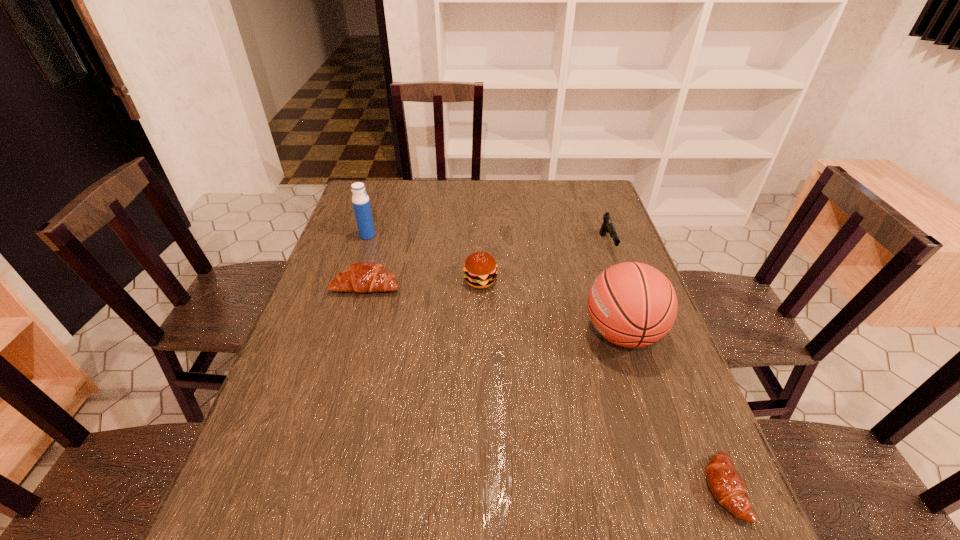
Where is `gun positioned at the right edge`? gun positioned at the right edge is located at coordinates (607, 227).

Image resolution: width=960 pixels, height=540 pixels. What are the coordinates of `basketball that is at the right edge` in the screenshot? It's located at (631, 304).

What are the coordinates of `object present at the near right corner` in the screenshot? It's located at (727, 486).

The height and width of the screenshot is (540, 960). In the image, there is a desktop. Identify the location of vacant space at the far edge. (408, 202).

The image size is (960, 540). In the image, there is a desktop. Find the location of `blank space at the right edge`. blank space at the right edge is located at coordinates (604, 246).

I want to click on free space at the far left corner, so click(x=365, y=183).

You are a GUI agent. You are given a task and a screenshot of the screen. Output one action in this format:
    pyautogui.click(x=<x>, y=<y>)
    Task: Click on the vacant space at the far right corner
    This screenshot has height=540, width=960.
    Given the screenshot: What is the action you would take?
    pyautogui.click(x=606, y=200)

In the image, there is a desktop. Identify the location of vacant space at the near right corner. (652, 488).

Identify the location of free space between the nearer crescent roll and the fifth tallest object. The height and width of the screenshot is (540, 960). (545, 387).

Image resolution: width=960 pixels, height=540 pixels. Find the location of `blank region between the farther crescent roll and the nearest object`. blank region between the farther crescent roll and the nearest object is located at coordinates (545, 387).